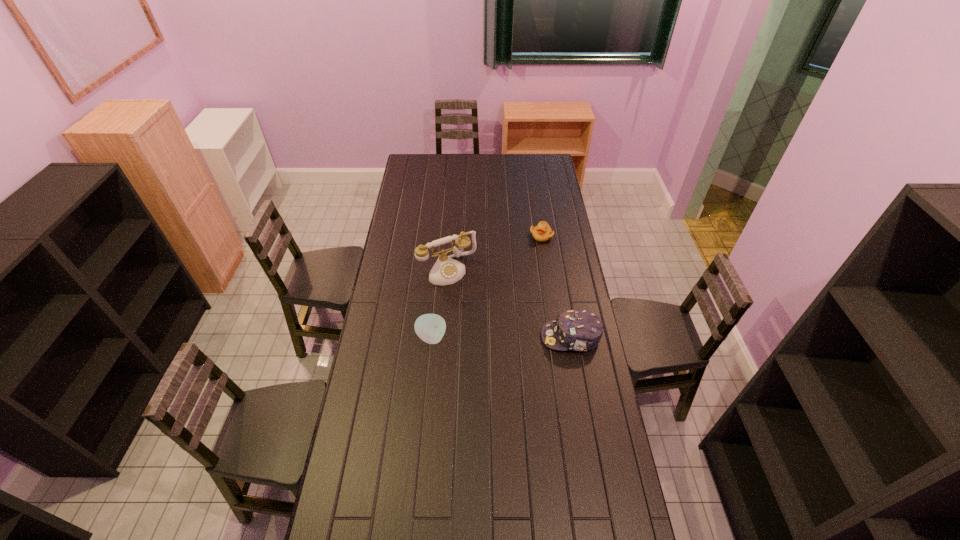
Locate an element on the screen. Image resolution: width=960 pixels, height=540 pixels. free spot on the desktop that is between the apple and the headwear and is positioned on the front-facing side of the duckling is located at coordinates (520, 338).

Where is `free space on the desktop that is between the apple and the headwear and is positioned on the dial of the telephone`? free space on the desktop that is between the apple and the headwear and is positioned on the dial of the telephone is located at coordinates (490, 338).